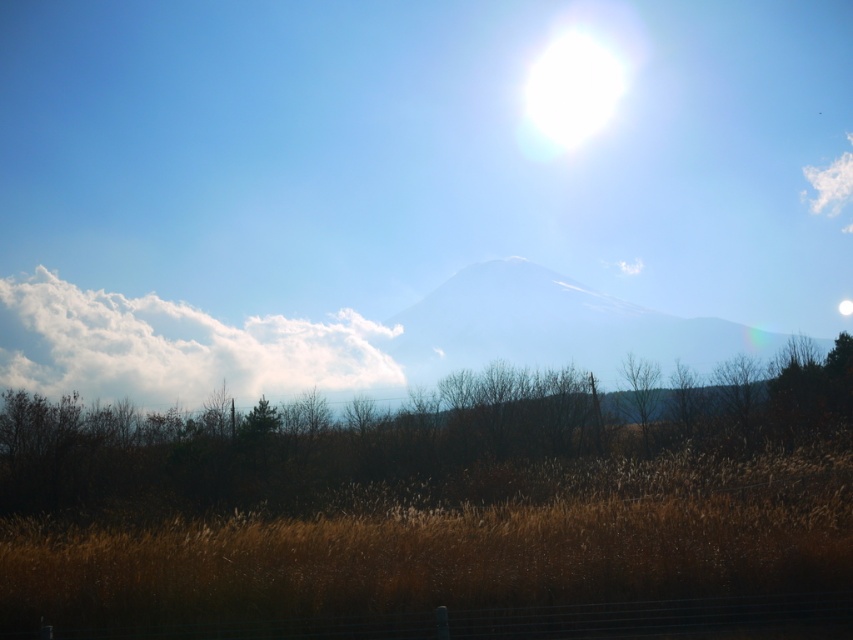
Question: Does brown grass at lower center have a greater width compared to white snow-capped mountain at center?

Choices:
 (A) no
 (B) yes

Answer: (A)

Question: From the image, what is the correct spatial relationship of brown dry grass at lower center in relation to white snow-capped mountain at center?

Choices:
 (A) right
 (B) left

Answer: (A)

Question: Does brown grass at lower center have a lesser width compared to white snow-capped mountain at center?

Choices:
 (A) no
 (B) yes

Answer: (B)

Question: Which point is farther to the camera?

Choices:
 (A) brown grass at lower center
 (B) white fluffy cloud at upper right
 (C) white fluffy cloud at upper left

Answer: (B)

Question: Which point is farther to the camera?

Choices:
 (A) brown grass at lower center
 (B) brown dry grass at lower center
 (C) white snow-capped mountain at center
 (D) white fluffy cloud at upper left

Answer: (D)

Question: Which of the following is the farthest from the observer?

Choices:
 (A) brown grass at lower center
 (B) brown dry grass at lower center
 (C) bright white snow at center

Answer: (C)